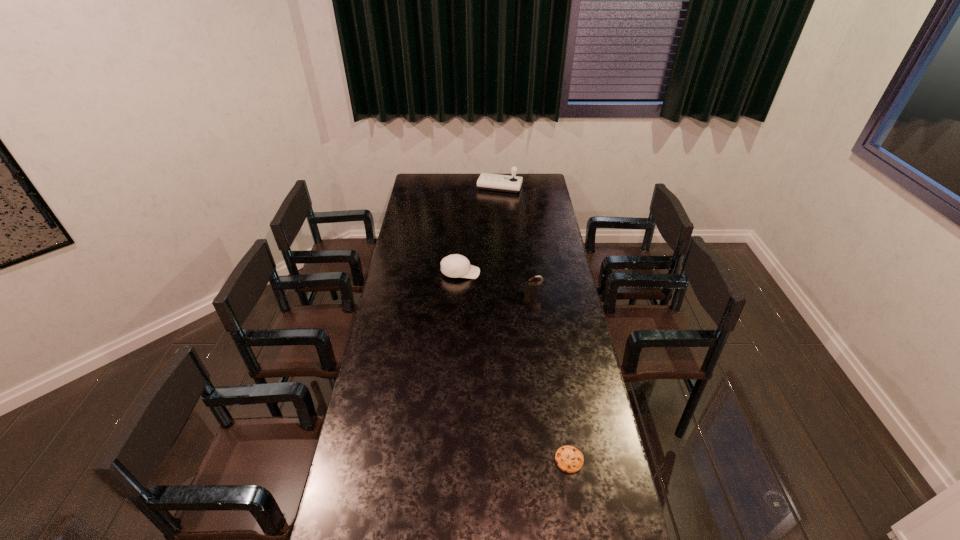
Find the location of a particular element. the tallest object is located at coordinates (495, 182).

This screenshot has width=960, height=540. I want to click on joystick, so pyautogui.click(x=495, y=182).

This screenshot has height=540, width=960. I want to click on the third farthest object, so click(530, 288).

Locate an element on the screen. the second farthest object is located at coordinates point(456,266).

Image resolution: width=960 pixels, height=540 pixels. What are the coordinates of `the shortest object` in the screenshot? It's located at (569, 459).

Where is `the nearest object`? The height and width of the screenshot is (540, 960). the nearest object is located at coordinates (569, 459).

I want to click on vacant area situated 0.240m on the left of the farthest object, so click(440, 187).

Locate an element on the screen. vacant space located 0.350m with the keyhole on the front of the third farthest object is located at coordinates tap(541, 353).

Where is `blank space located on the front-facing side of the baseball cap`? Image resolution: width=960 pixels, height=540 pixels. blank space located on the front-facing side of the baseball cap is located at coordinates (506, 273).

What are the coordinates of `vacant point located on the left of the nearest object` in the screenshot? It's located at (435, 460).